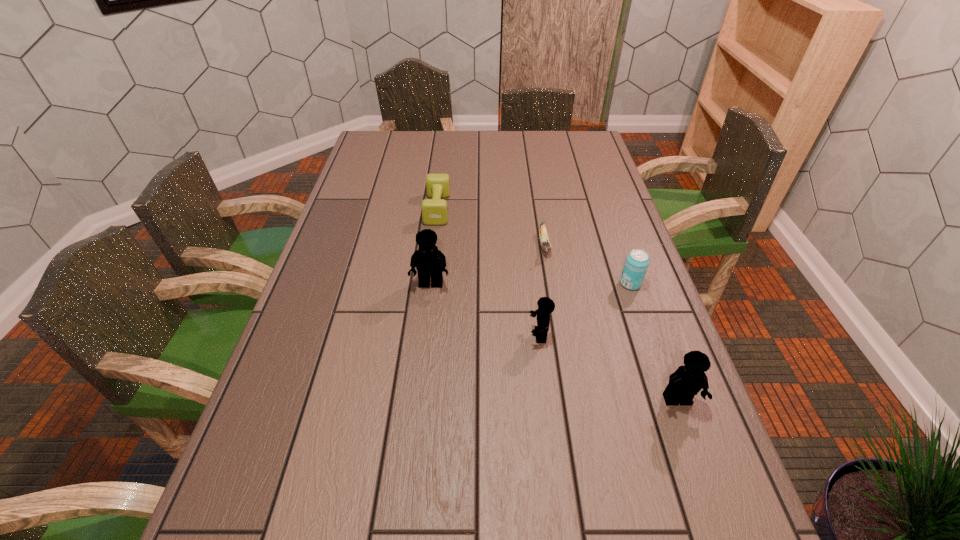
Find the location of `the farthest Lego`. the farthest Lego is located at coordinates (428, 260).

The height and width of the screenshot is (540, 960). Find the location of `the second Lego from left to right`. the second Lego from left to right is located at coordinates (546, 306).

Identify the location of the third object from left to right. The width and height of the screenshot is (960, 540). (546, 306).

Identify the location of the rightmost Lego. (687, 381).

The width and height of the screenshot is (960, 540). I want to click on the nearest Lego, so point(687,381).

Where is `the farthest object`? The width and height of the screenshot is (960, 540). the farthest object is located at coordinates (434, 211).

The width and height of the screenshot is (960, 540). I want to click on the third shortest object, so click(x=636, y=264).

The image size is (960, 540). I want to click on banana, so click(x=545, y=243).

You are a GUI agent. You are given a task and a screenshot of the screen. Output one action in this format:
    pyautogui.click(x=<x>, y=<y>)
    Task: Click on the fifth nearest object
    Image resolution: width=960 pixels, height=540 pixels.
    Given the screenshot: What is the action you would take?
    pyautogui.click(x=545, y=243)

The height and width of the screenshot is (540, 960). Find the location of `vacant space located on the front-facing side of the leftmost Lego`. vacant space located on the front-facing side of the leftmost Lego is located at coordinates (426, 326).